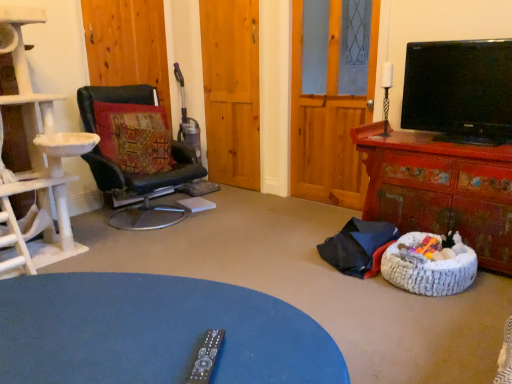
Where is `free space behind black plastic remote at center`? The height and width of the screenshot is (384, 512). free space behind black plastic remote at center is located at coordinates (216, 321).